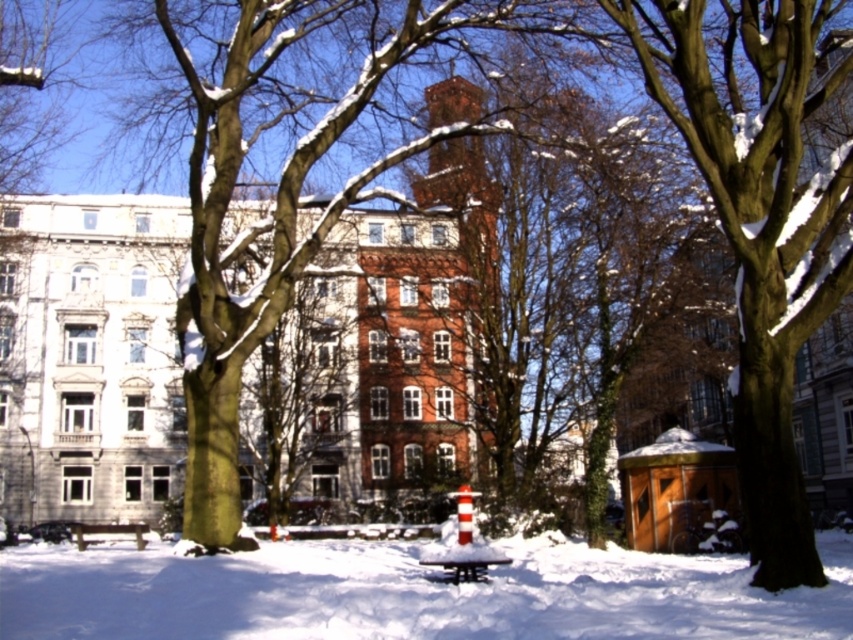
You are standing in the winter scene described and want to place a small snowman exactly at the center of the image. According to the coordinates provided, is the white fluffy snow at center located at the correct position for building the snowman?

The white fluffy snow at center is located at coordinates point (408, 593), so yes, it is at the correct position for building the snowman there.

Looking at this image, you are a visitor in the park and want to sit on the wooden park bench at center. Where should you walk towards from the white fluffy snow at center?

The white fluffy snow at center is to the left of the wooden park bench at center, so you should walk towards the right to reach the wooden park bench at center.

You are a snowplow operator who needs to clear the snow from the wooden park bench at center. If your snowplow has a maximum reach of 20 meters, can you reach the bench from your current position at the white fluffy snow at center without moving the vehicle?

The distance between the white fluffy snow at center and the wooden park bench at center is 19.57 meters, which is within the snowplow operator vehicle maximum reach of 20 meters. Therefore, the operator can reach the bench without moving the vehicle.